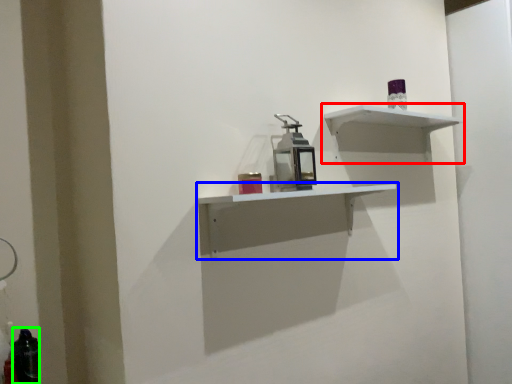
Question: Considering the real-world distances, which object is closest to shelf (highlighted by a red box)? shelf (highlighted by a blue box) or bottle (highlighted by a green box).

Choices:
 (A) shelf
 (B) bottle

Answer: (A)